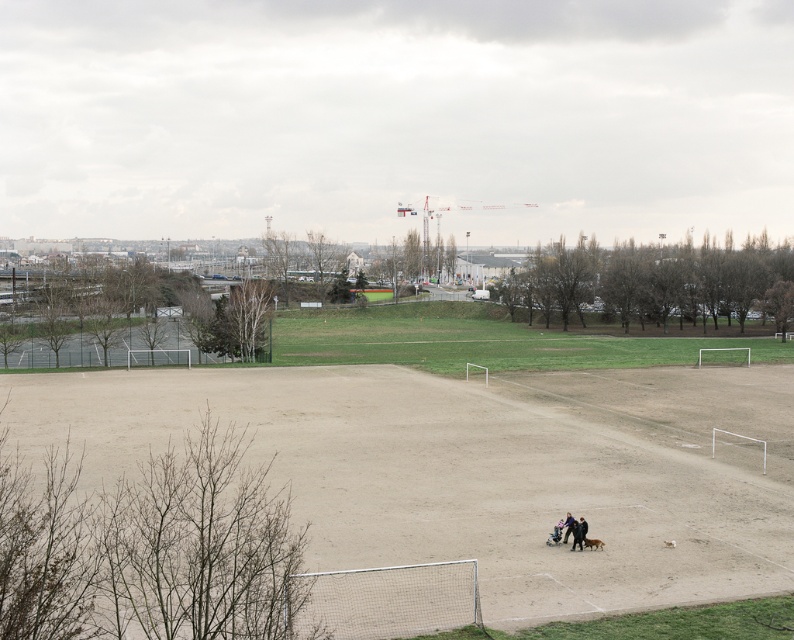
Which of these two, matte black couple at lower right or dark blue jeans at lower center, stands taller?

With more height is dark blue jeans at lower center.

Looking at this image, can you confirm if matte black couple at lower right is shorter than dark blue jeans at lower center?

Yes.

Who is more distant from viewer, [565,522] or [571,525]?

The point [565,522] is more distant.

Where is `matte black couple at lower right`? The height and width of the screenshot is (640, 794). matte black couple at lower right is located at coordinates (571, 529).

Measure the distance from brown sandy dirt field at center to dark blue jeans at lower center.

brown sandy dirt field at center and dark blue jeans at lower center are 25.77 meters apart.

Can you confirm if brown sandy dirt field at center is bigger than dark blue jeans at lower center?

Indeed, brown sandy dirt field at center has a larger size compared to dark blue jeans at lower center.

Is point (698, 588) behind point (573, 531)?

No, (698, 588) is in front of (573, 531).

Where is `brown sandy dirt field at center`? This screenshot has height=640, width=794. brown sandy dirt field at center is located at coordinates (478, 468).

Between point (626, 369) and point (584, 522), which one is positioned in front?

Point (584, 522)

Is the position of brown sandy dirt field at center more distant than that of matte black couple at lower right?

No, it is in front of matte black couple at lower right.

Identify the location of brown sandy dirt field at center. (478, 468).

Find the location of a particular element. The width and height of the screenshot is (794, 640). brown sandy dirt field at center is located at coordinates (478, 468).